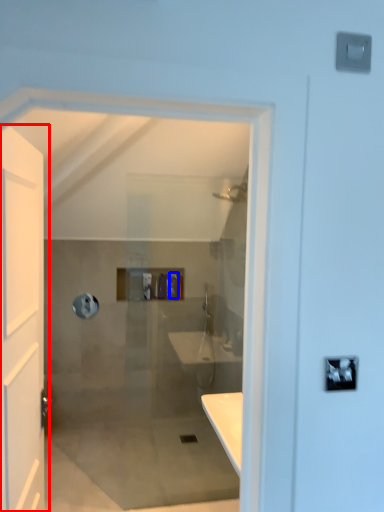
Question: Which point is further to the camera, door (highlighted by a red box) or toiletry (highlighted by a blue box)?

Choices:
 (A) door
 (B) toiletry

Answer: (B)